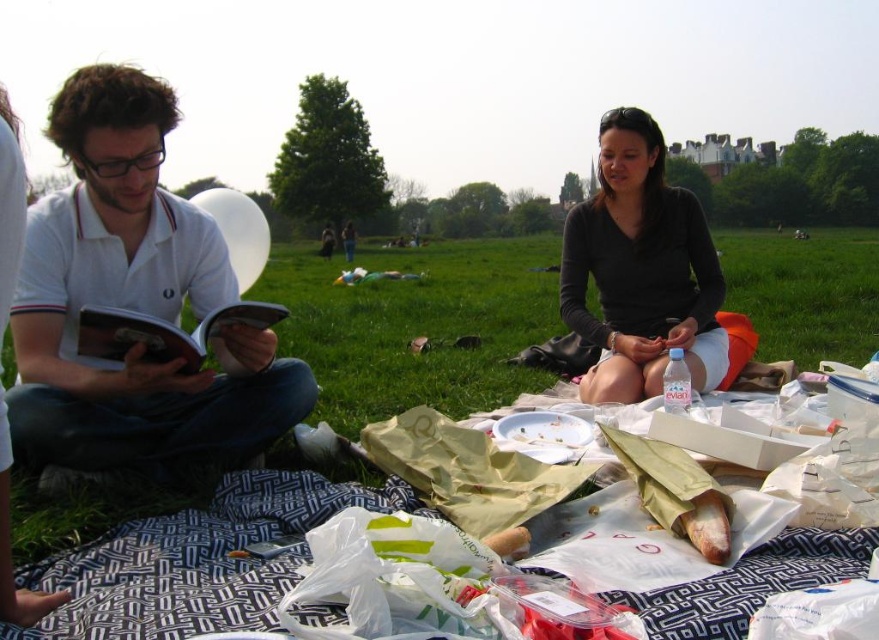
Between white cotton polo shirt at left and white cotton shirt at left, which one has less height?

With less height is white cotton polo shirt at left.

Between point (57, 360) and point (42, 208), which one is positioned behind?

Positioned behind is point (42, 208).

Who is more distant from viewer, [40,371] or [264,433]?

The point [264,433] is more distant.

Where is `white cotton polo shirt at left`? This screenshot has width=879, height=640. white cotton polo shirt at left is located at coordinates (133, 305).

Who is positioned more to the left, white cotton shirt at left or green grass at center?

Positioned to the left is white cotton shirt at left.

Between white cotton shirt at left and green grass at center, which one has less height?

white cotton shirt at left

Is point (242, 420) less distant than point (442, 401)?

Yes, it is in front of point (442, 401).

I want to click on white cotton shirt at left, so click(x=133, y=301).

Is white cotton polo shirt at left positioned at the back of green grass at center?

No, white cotton polo shirt at left is closer to the viewer.

Is point (107, 387) farther from camera compared to point (481, 289)?

No, it is not.

You are a GUI agent. You are given a task and a screenshot of the screen. Output one action in this format:
    pyautogui.click(x=<x>, y=<y>)
    Task: Click on the white cotton polo shirt at left
    
    Given the screenshot: What is the action you would take?
    pyautogui.click(x=133, y=305)